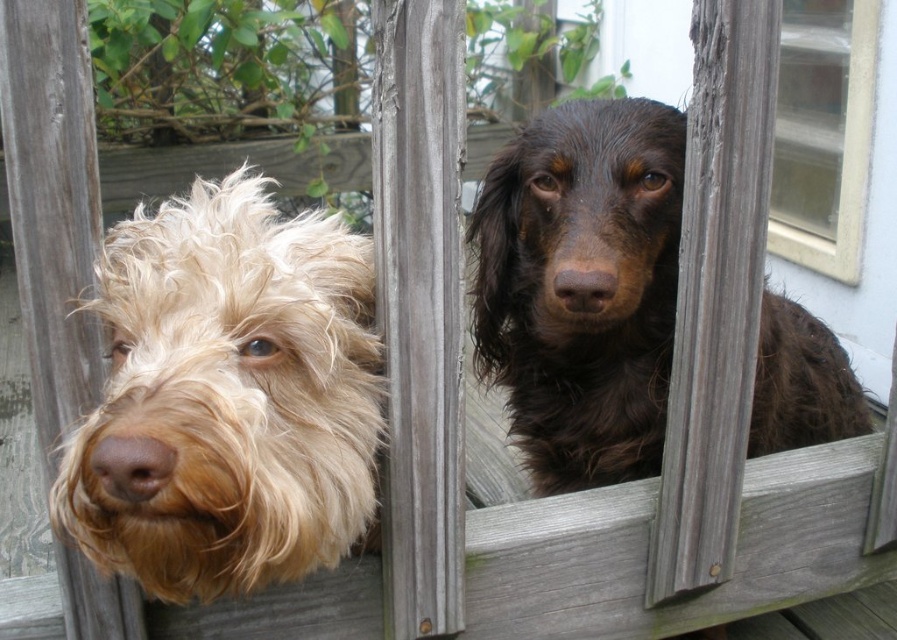
You are a dog owner who wants to know the position of the shiny brown fur at center and the brown matte nose at center on your dog. Which one is closer to the ground?

The shiny brown fur at center is located below the brown matte nose at center, so the shiny brown fur at center is closer to the ground.

Based on the photo, you are a delivery person trying to see through the white plastic window at upper right and the brown matte nose at center. Which object allows you to see more of the area behind the fence due to its size?

The white plastic window at upper right allows you to see more of the area behind the fence because its width is larger than the brown matte nose at center.

You are a dog trainer observing two dogs through a fence. You notice their noses. Which dog has a larger nose? The options are the brown matte nose at left and the brown matte nose at center.

The brown matte nose at center has a larger nose than the brown matte nose at left.